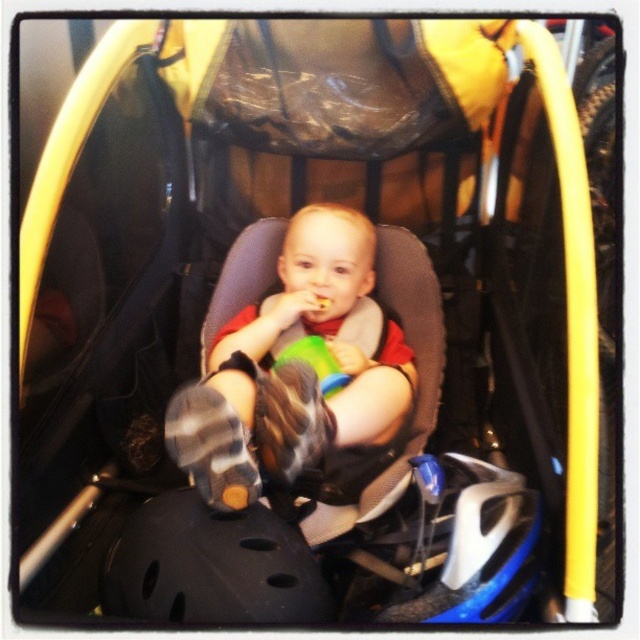
Does point (371, 282) lie in front of point (301, 604)?

No, it is not.

Is matte gray baby at center in front of black matte bicycle helmet at lower center?

No, matte gray baby at center is further to the viewer.

Which is in front, point (241, 381) or point (316, 612)?

Point (316, 612) is in front.

At what (x,y) coordinates should I click in order to perform the action: click on matte gray baby at center. Please return your answer as a coordinate pair (x, y). Looking at the image, I should click on (291, 371).